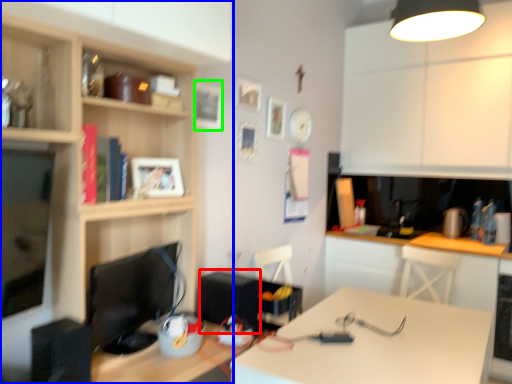
Question: Considering the real-world distances, which object is farthest from appliance (highlighted by a red box)? cabinetry (highlighted by a blue box) or picture frame (highlighted by a green box)?

Choices:
 (A) cabinetry
 (B) picture frame

Answer: (B)